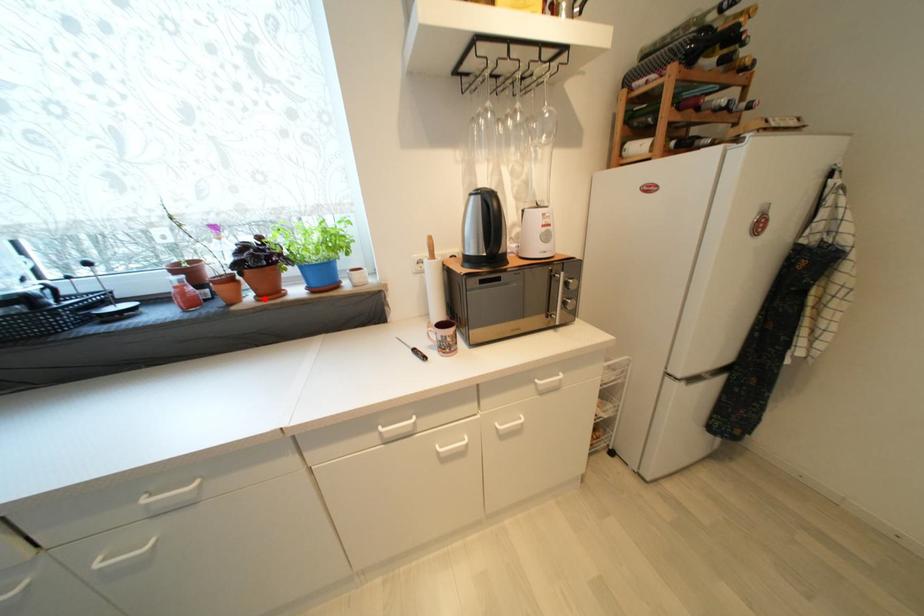
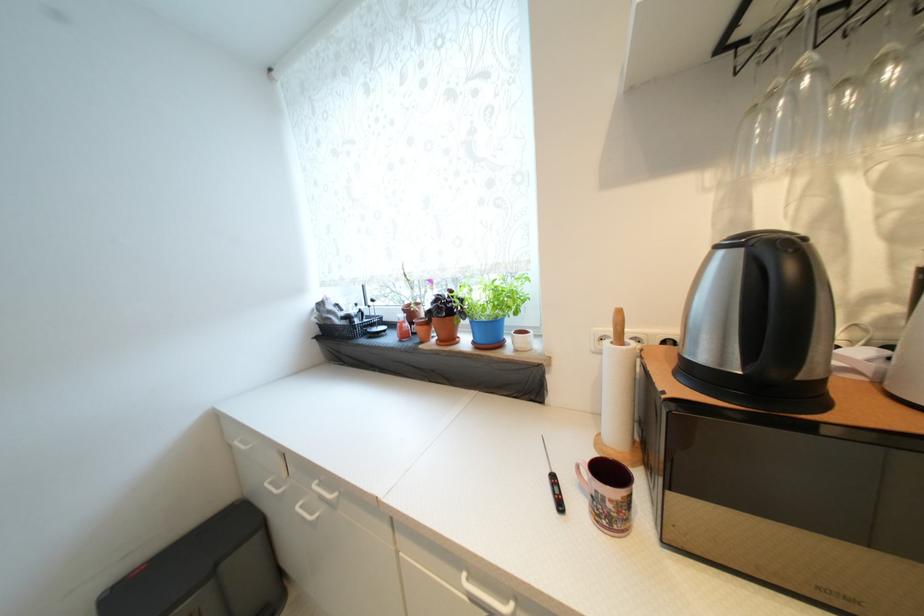
The point at the highlighted location is marked in the first image. Where is the corresponding point in the second image?

(445, 342)